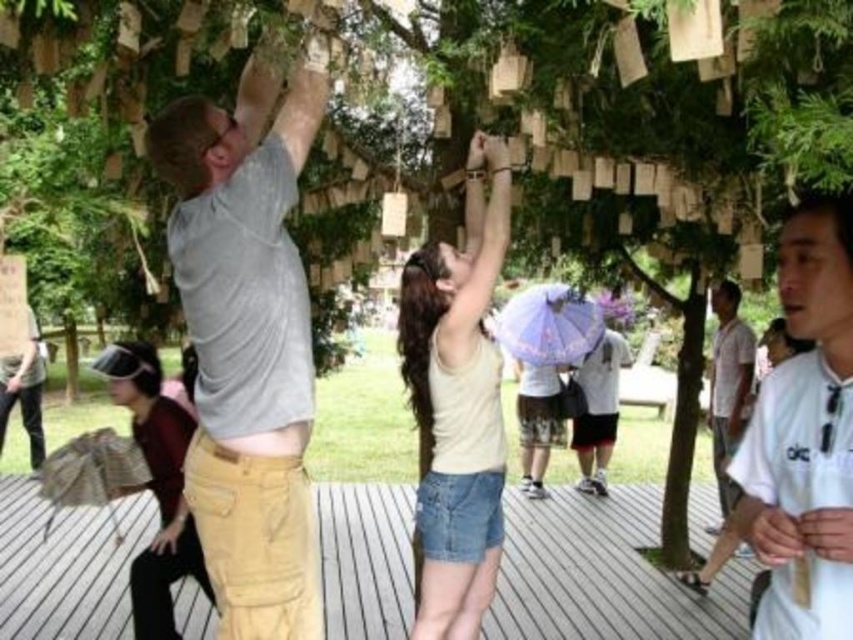
Question: Which object is closer to the camera taking this photo?

Choices:
 (A) white cotton shirt at right
 (B) khaki pants at upper center
 (C) matte purple umbrella at center
 (D) white matte shirt at center

Answer: (D)

Question: Is white matte shirt at center smaller than matte purple umbrella at center?

Choices:
 (A) no
 (B) yes

Answer: (B)

Question: Which of these objects is positioned closest to the white matte shirt at center?

Choices:
 (A) matte purple umbrella at center
 (B) white cotton shirt at right
 (C) light beige tank top at center
 (D) khaki pants at upper center

Answer: (D)

Question: Can you confirm if khaki pants at upper center is wider than matte purple umbrella at center?

Choices:
 (A) no
 (B) yes

Answer: (A)

Question: Among these points, which one is farthest from the camera?

Choices:
 (A) (819, 429)
 (B) (218, 444)
 (C) (614, 348)
 (D) (434, 324)

Answer: (C)

Question: In this image, where is khaki pants at upper center located relative to white matte shirt at center?

Choices:
 (A) above
 (B) below

Answer: (A)